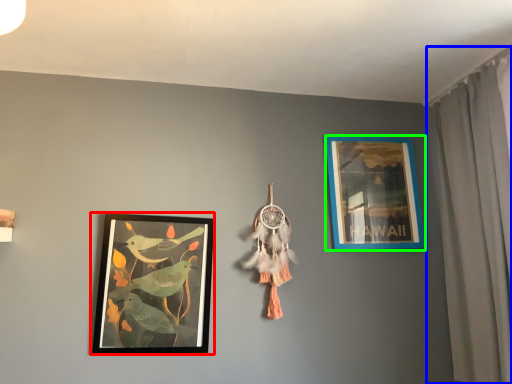
Question: Which object is the farthest from picture frame (highlighted by a red box)? Choose among these: curtain (highlighted by a blue box) or picture frame (highlighted by a green box).

Choices:
 (A) curtain
 (B) picture frame

Answer: (A)